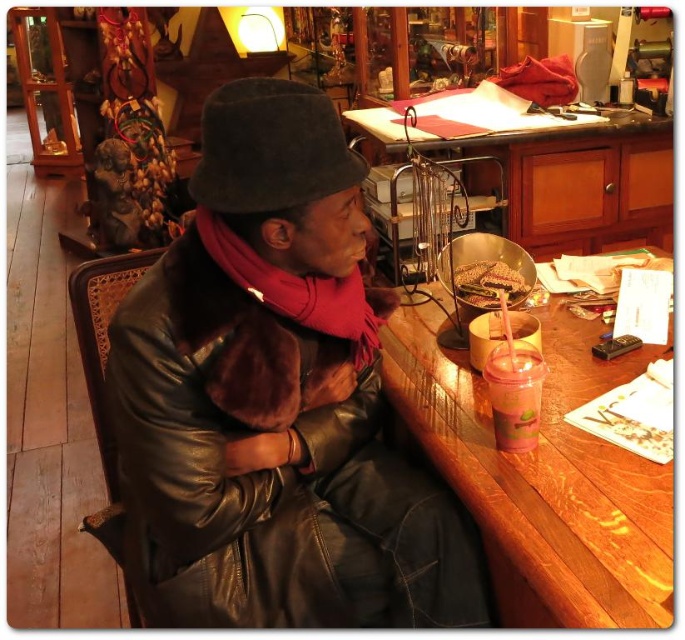
You are helping organize the items on the wooden table at upper center and the leather jacket at center. Since space is limited, you need to know which item takes up more horizontal space. Which one is wider?

The leather jacket at center has a lesser width compared to wooden table at upper center, so the wooden table at upper center is wider.

You are a customer in the shop and want to place your new purchase on the wooden table at upper center. However, you notice the leather jacket at center is currently on the table. Can you still place your item there without moving the jacket?

The leather jacket at center is much taller than the wooden table at upper center, so placing your item there might be difficult due to the jacket taking up most of the space.

You are a customer in the shop and want to place your phone on the wooden table at right. However, there is a translucent plastic cup at right in the way. Can you place your phone there without moving the cup?

The wooden table at right is positioned under the translucent plastic cup at right, so the cup is likely above the table. Therefore, you can place your phone on the wooden table at right without moving the cup since the cup is above it.